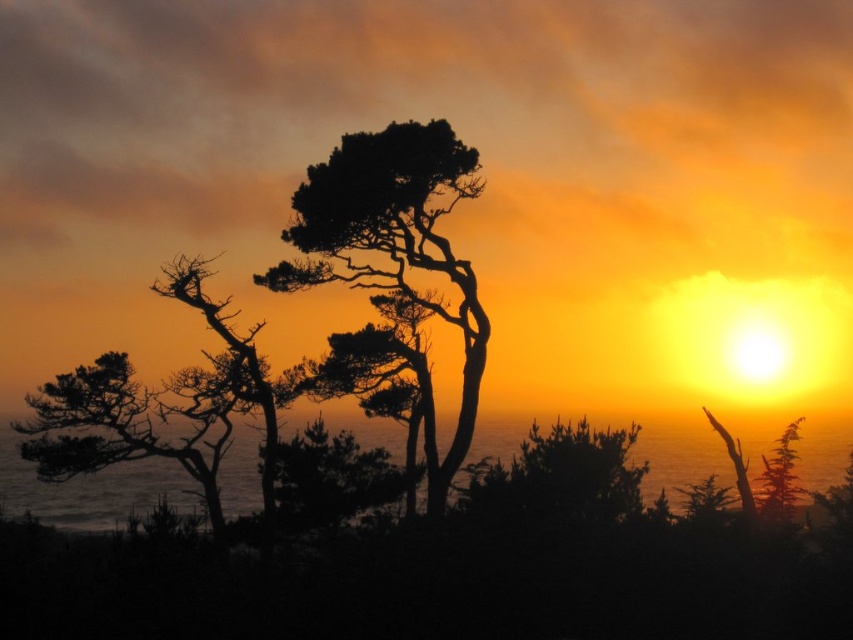
You are an artist trying to paint the sunset scene. You want to ensure the silhouette bark tree at center and transparent water at lower center are proportionally accurate. Which object should you make thinner when painting?

The silhouette bark tree at center should be made thinner than the transparent water at lower center.

You are an artist trying to paint the sunset scene. You notice the silhouette bark tree at center and the transparent water at lower center. Which object should you paint first if you want to follow the rule of painting taller objects before shorter ones?

The transparent water at lower center is taller than the silhouette bark tree at center, so you should paint the transparent water at lower center first.